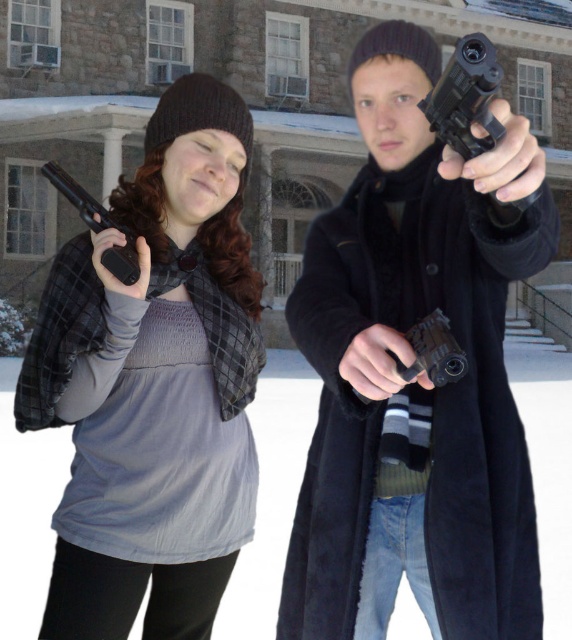
Question: Which of the following is the closest to the observer?

Choices:
 (A) (121, 250)
 (B) (519, 205)

Answer: (B)

Question: Which is farther from the matte black gun at left?

Choices:
 (A) black plastic handgun at center
 (B) matte black handgun at left

Answer: (A)

Question: Is black plastic handgun at center above matte black handgun at left?

Choices:
 (A) no
 (B) yes

Answer: (A)

Question: Does matte black gun at left have a smaller size compared to black plastic handgun at center?

Choices:
 (A) no
 (B) yes

Answer: (A)

Question: Which object is closer to the camera taking this photo?

Choices:
 (A) matte black handgun at left
 (B) matte black gun at left

Answer: (A)

Question: Is the position of black plastic handgun at center less distant than that of matte black handgun at left?

Choices:
 (A) yes
 (B) no

Answer: (A)